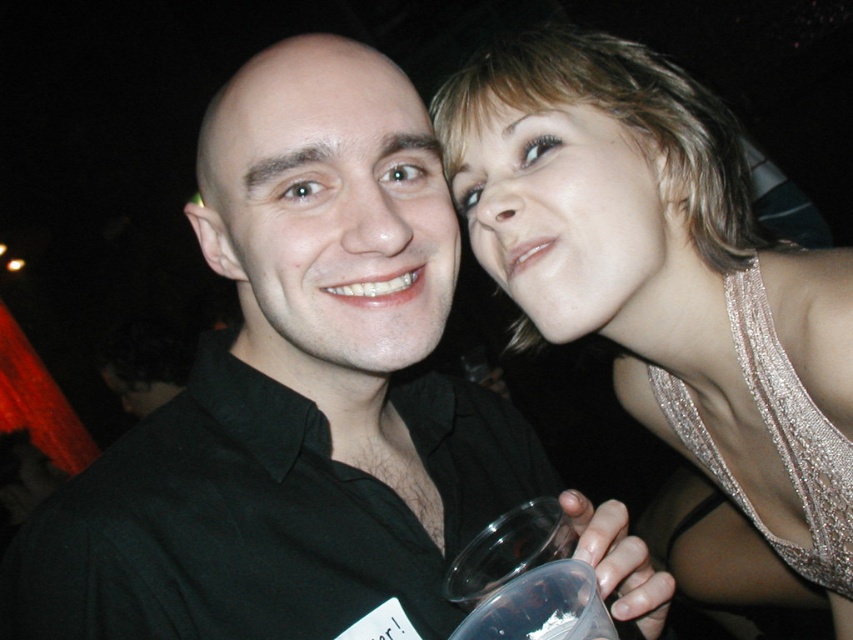
You are a photographer trying to frame a photo of the sparkly gold dress at upper right and the smooth skin face at upper right. Which object should you focus on if you want to capture the wider subject?

The sparkly gold dress at upper right should be focused on since its width is larger than the smooth skin face at upper right.

You are a photographer at the event and want to ensure both the sparkly gold dress at upper right and the smooth skin face at upper right are in focus. Given that the dress is larger than the face, which object should you adjust your focus on first to ensure both are clear?

The sparkly gold dress at upper right has a larger size compared to the smooth skin face at upper right. To ensure both are in focus, adjust focus on the sparkly gold dress at upper right first since it is larger and requires more detailed focus.

You are a photographer at a party and want to ensure both the smooth skin face at upper right and the sparkly silver dress at upper right are in focus. Which one should you adjust your camera focus to prioritize to ensure the thinner object is sharp?

The smooth skin face at upper right is thinner than the sparkly silver dress at upper right, so you should prioritize focusing on the smooth skin face at upper right to ensure it is sharp.